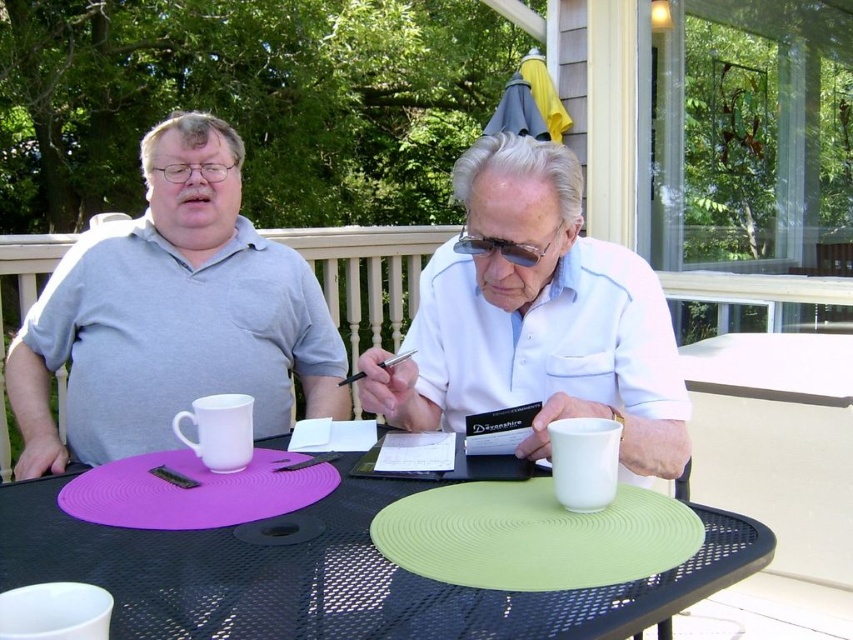
You are a delivery person who needs to place a rectangular package on the table. The package is 12 inches long. You see the green rubber placemat at center and the matte white mug at center. Which object has enough space to accommodate the package without overlapping other items?

The green rubber placemat at center has a greater width than the matte white mug at center. Since the package is 12 inches long, the green rubber placemat at center can accommodate the package without overlapping other items as it is wider.

You are standing in front of the black metal table and want to place a small object on the table. If you want to place it closer to the camera, which point should you choose between point (140,586) and point (148,161)?

Point (140,586) is closer to the camera than point (148,161), so you should place the object at point (140,586) to have it closer to the camera.